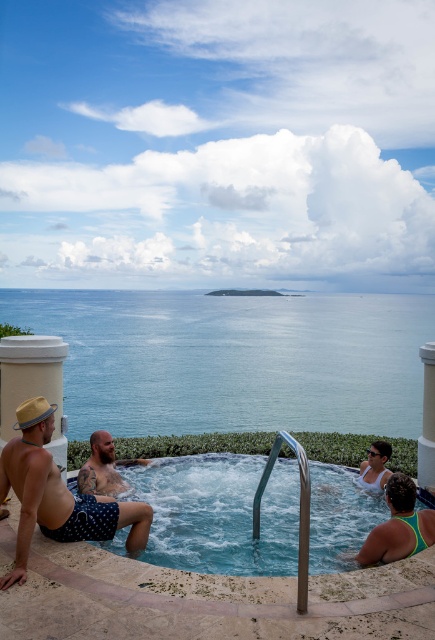
Question: Can you confirm if clear plastic hot tub at center is bigger than beige textured shorts at center?

Choices:
 (A) yes
 (B) no

Answer: (A)

Question: Is beige textured shorts at center to the right of white matte swimsuit at lower right from the viewer's perspective?

Choices:
 (A) no
 (B) yes

Answer: (A)

Question: Based on their relative distances, which object is nearer to the clear plastic hot tub at center?

Choices:
 (A) white matte swimsuit at lower right
 (B) polka dot swim trunks at left
 (C) beige textured shorts at center

Answer: (A)

Question: Does blue water at lower center have a lesser width compared to beige textured shorts at center?

Choices:
 (A) no
 (B) yes

Answer: (A)

Question: Estimate the real-world distances between objects in this image. Which object is farther from the white matte swimsuit at lower right?

Choices:
 (A) beige textured shorts at center
 (B) blue water at lower center

Answer: (B)

Question: Which point is closer to the camera?

Choices:
 (A) (380, 449)
 (B) (320, 422)

Answer: (A)